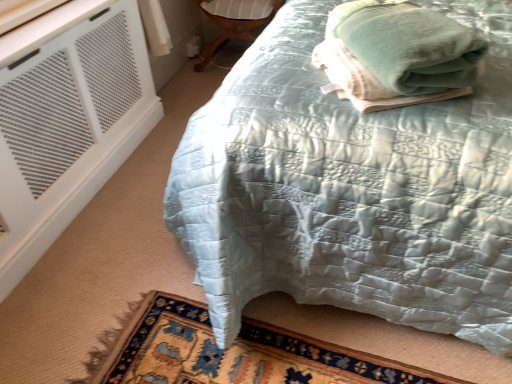
The image size is (512, 384). Identify the location of unoccupied region to the right of white mesh air conditioning at lower left. pos(150,191).